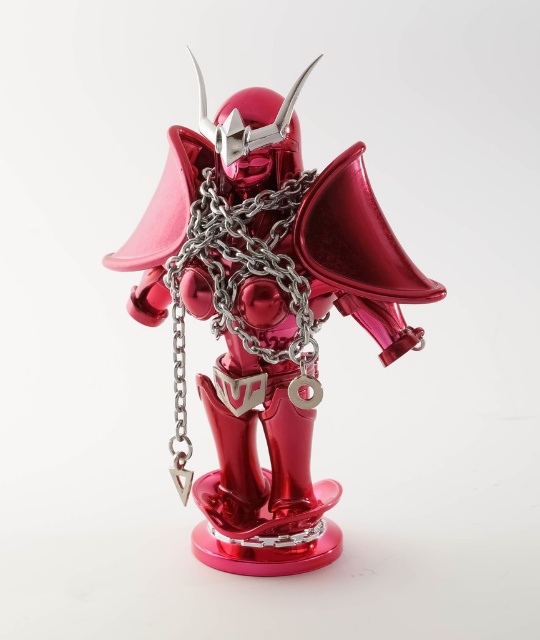
You are an inspector checking the alignment of two points on a metallic figurine. The points are labeled as point 1 at position (x=284, y=540) and point 2 at position (x=179, y=257). From your vantage point, which point is closer to you?

Point 2 at position (x=179, y=257) is closer to you because point 1 at position (x=284, y=540) is behind it.

You are a collector who wants to display the metallic red armor at center on a shelf that is 28 inches away from you. Can you place it there without moving closer?

The metallic red armor at center is currently 30.71 inches away from the viewer, which is farther than the 28 inches shelf. Therefore, you cannot place it on the shelf without moving closer.

You are a collector who wants to display the metallic red armor at center and the metallic silver chain at center on a shelf. The shelf has a width of 2.5 inches. Can both items fit side by side without overlapping?

The metallic red armor at center is 2.29 inches from metallic silver chain at center, so yes, both items can fit side by side on the 2.5 inch shelf since the combined width of the two items is less than the shelf width.